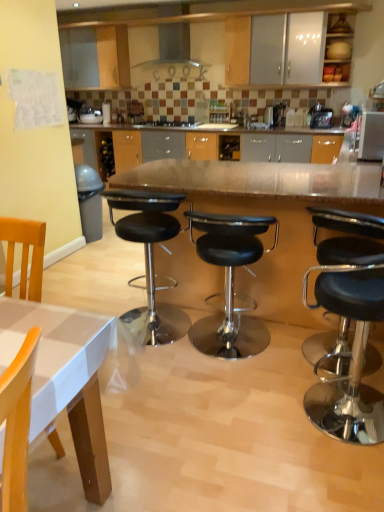
Question: In terms of height, does satin silver microwave at upper right look taller or shorter compared to black leather stool at center, positioned as the 2th stool in left-to-right order?

Choices:
 (A) short
 (B) tall

Answer: (A)

Question: From the image's perspective, is satin silver microwave at upper right above or below black leather stool at center, positioned as the 2th stool in left-to-right order?

Choices:
 (A) above
 (B) below

Answer: (A)

Question: Which of these objects is positioned closest to the polished wood table at center?

Choices:
 (A) black leather stool at center, which is counted as the third stool, starting from the right
 (B) black leather stool at center, positioned as the 2th stool in left-to-right order
 (C) wooden chair at lower left
 (D) black leather stool at right, which is the third stool from left to right
 (E) satin silver microwave at upper right

Answer: (B)

Question: Which object is the closest to the polished wood table at center?

Choices:
 (A) black leather stool at center, the 2th stool viewed from the right
 (B) black glass stove at center
 (C) satin silver microwave at upper right
 (D) black leather stool at center, which is counted as the third stool, starting from the right
 (E) wooden chair at lower left

Answer: (A)